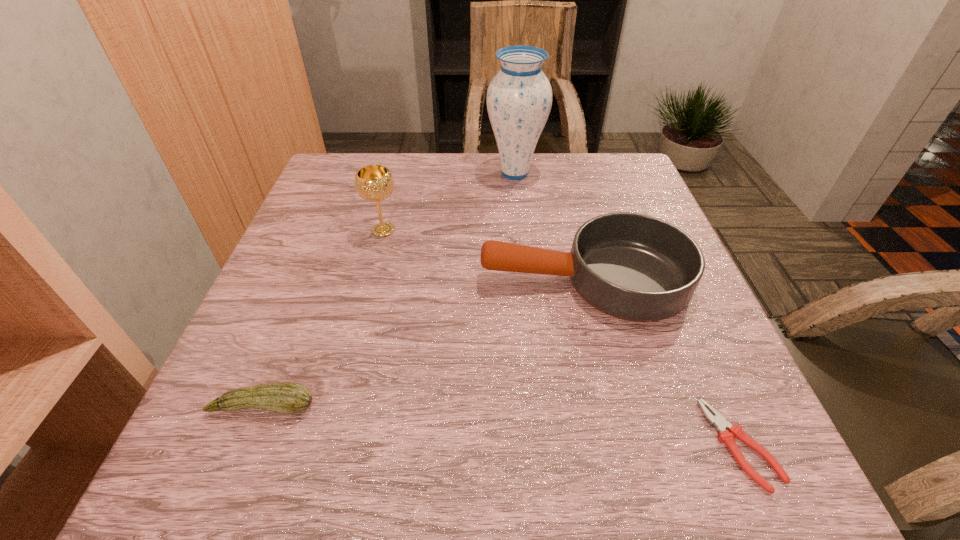
Find the location of a particular element. The width and height of the screenshot is (960, 540). vacant region located on the handle side of the pan is located at coordinates (436, 279).

At what (x,y) coordinates should I click in order to perform the action: click on free spot located 0.190m on the back of the pliers. Please return your answer as a coordinate pair (x, y). Image resolution: width=960 pixels, height=540 pixels. Looking at the image, I should click on (682, 311).

Identify the location of object at the far edge. (519, 98).

Find the location of `object located in the near edge section of the desktop`. object located in the near edge section of the desktop is located at coordinates (734, 431).

Identify the location of object positioned at the left edge. Image resolution: width=960 pixels, height=540 pixels. (283, 397).

Identify the location of pan that is at the right edge. The image size is (960, 540). (635, 267).

Locate an element on the screen. The height and width of the screenshot is (540, 960). pliers that is positioned at the right edge is located at coordinates (734, 431).

Image resolution: width=960 pixels, height=540 pixels. I want to click on object that is at the near right corner, so click(734, 431).

In the image, there is a desktop. Identify the location of free space at the far edge. (548, 176).

The width and height of the screenshot is (960, 540). I want to click on vacant space at the near edge, so click(x=475, y=460).